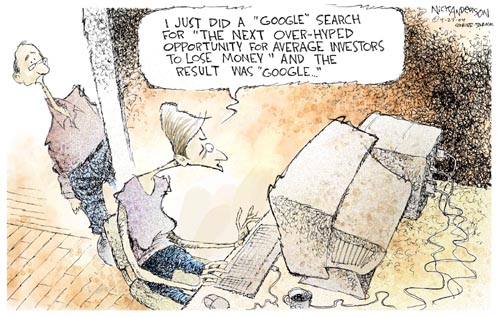
The width and height of the screenshot is (500, 317). I want to click on mouse, so click(216, 297).